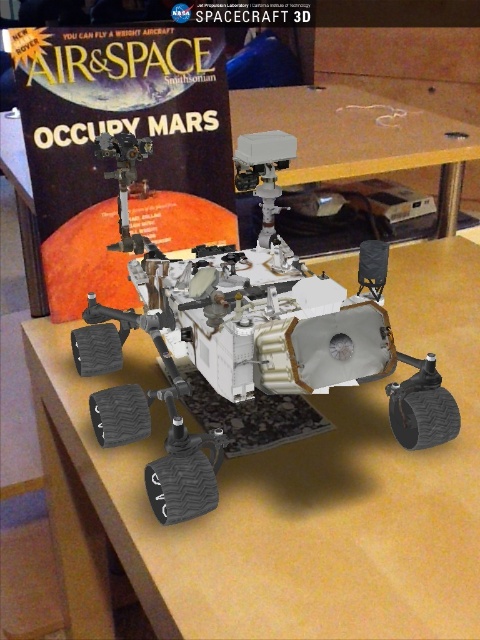
Question: Among these objects, which one is nearest to the camera?

Choices:
 (A) light brown wood table at center
 (B) wooden table at center

Answer: (A)

Question: Does light brown wood table at center appear over wooden table at center?

Choices:
 (A) no
 (B) yes

Answer: (A)

Question: Is light brown wood table at center smaller than wooden table at center?

Choices:
 (A) no
 (B) yes

Answer: (A)

Question: Which object is closer to the camera taking this photo?

Choices:
 (A) light brown wood table at center
 (B) wooden table at center

Answer: (A)

Question: Observing the image, what is the correct spatial positioning of light brown wood table at center in reference to wooden table at center?

Choices:
 (A) right
 (B) left

Answer: (B)